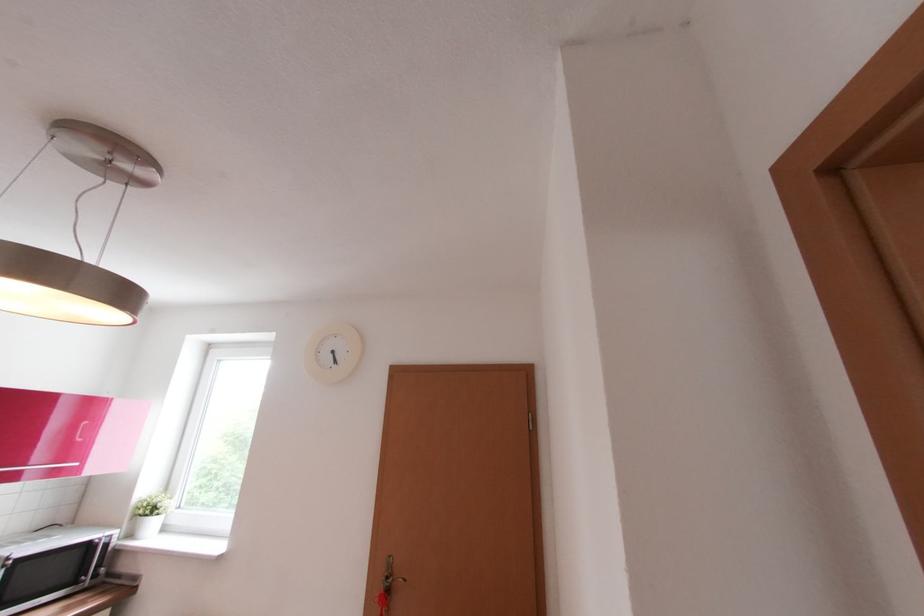
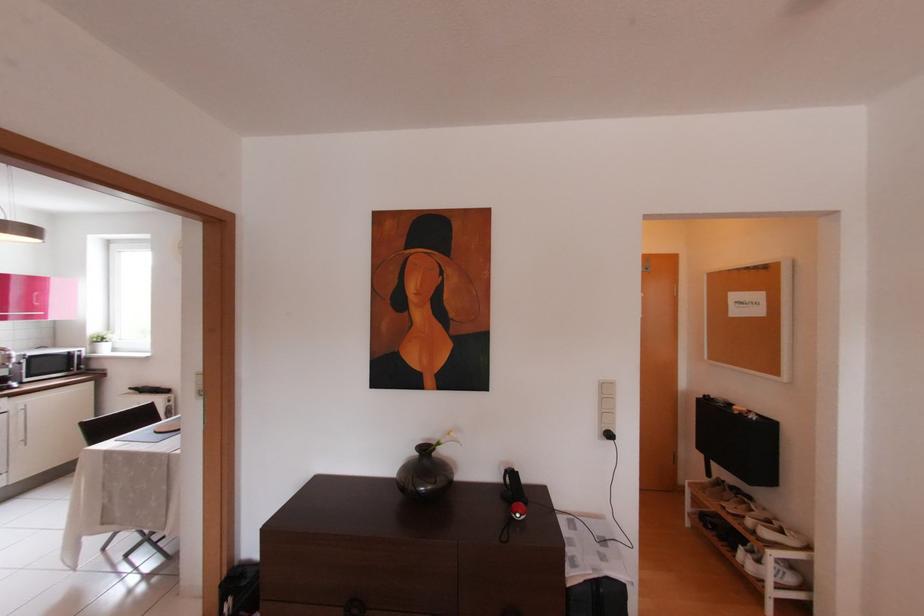
Which direction would the cameraman need to move to produce the second image?

The movement direction of the cameraman is right, backward.